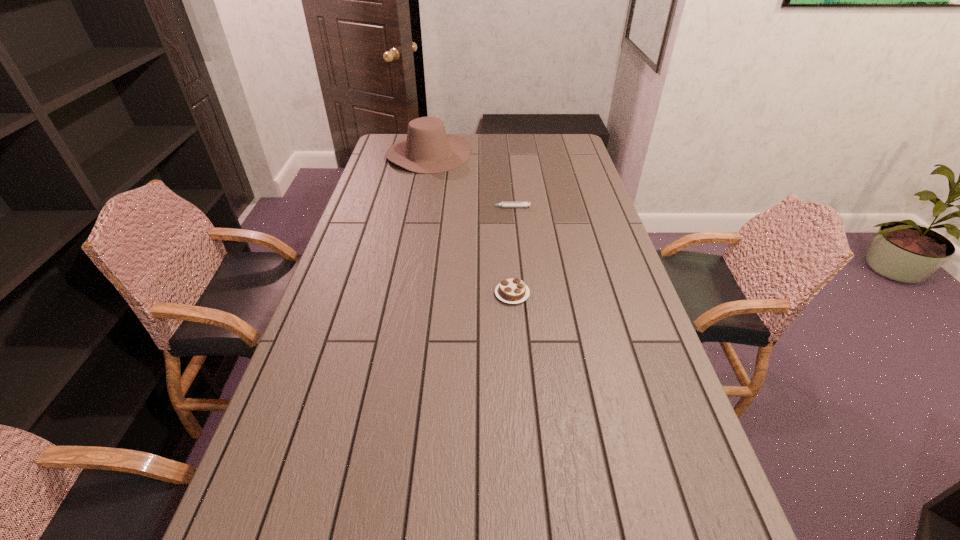
This screenshot has width=960, height=540. Identify the location of the closest object to the chocolate cake. (503, 204).